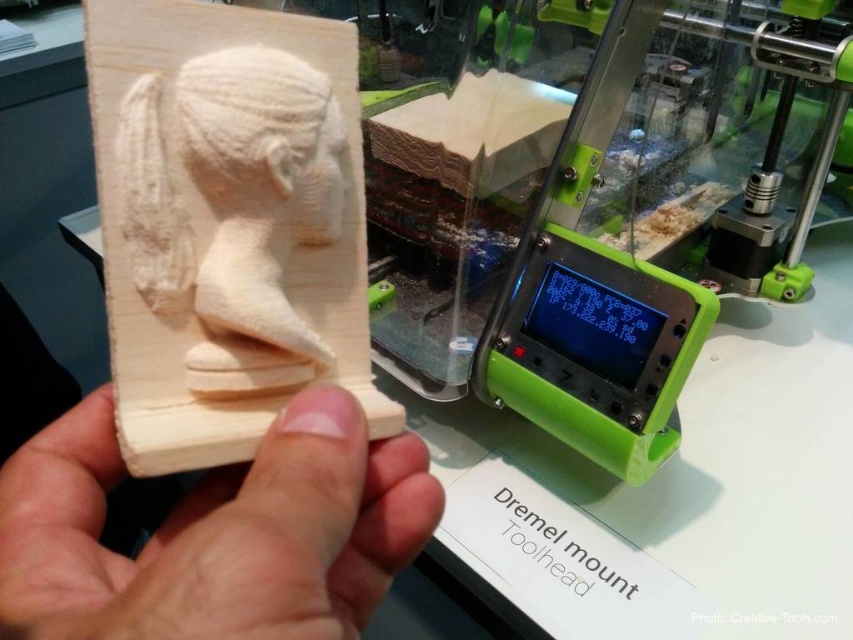
You are a woodworker observing the scene. You notice the light wood at center and the white wood carving at center. Which object is closer to you?

The light wood at center is closer to you because it is in front of the white wood carving at center.

You are a woodworker observing the scene. You notice the light wood at center and the wooden sculpture at center. Which object is closer to you?

The light wood at center is closer to you because it is in front of the wooden sculpture at center.

You are a woodworker trying to place a small tool between the wooden sculpture at center and the white wood carving at center. The tool requires 1.2 centimeters of space to fit. Based on the scene, can the tool fit between them?

The wooden sculpture at center and the white wood carving at center are 1.18 centimeters apart, which is slightly less than the required 1.2 centimeters. Therefore, the tool cannot fit between them.